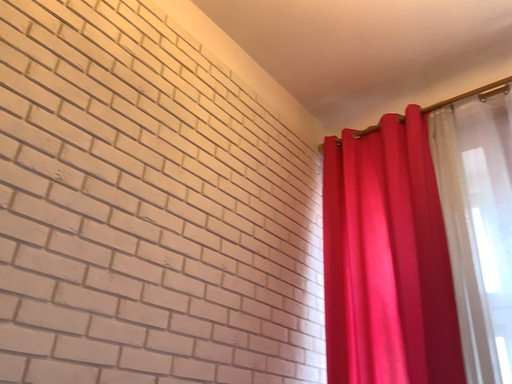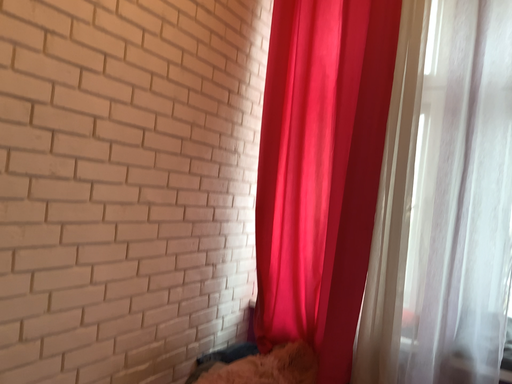
Question: Which way did the camera rotate in the video?

Choices:
 (A) rotated left
 (B) rotated right

Answer: (B)